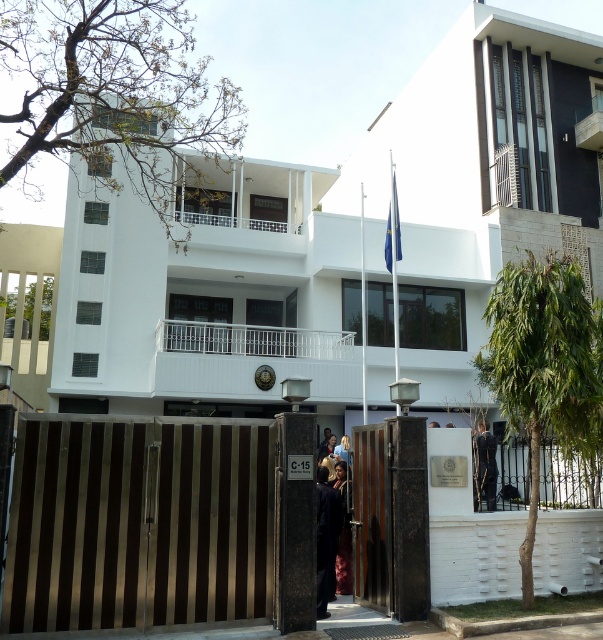
Which is more to the right, dark blue fabric coat at center or dark suit at center?

dark suit at center is more to the right.

Between dark blue fabric coat at center and dark suit at center, which one appears on the left side from the viewer's perspective?

Positioned to the left is dark blue fabric coat at center.

What do you see at coordinates (326, 538) in the screenshot?
I see `dark blue fabric coat at center` at bounding box center [326, 538].

Locate an element on the screen. The width and height of the screenshot is (603, 640). dark blue fabric coat at center is located at coordinates (326, 538).

Looking at this image, is dark suit at center taller than dark brown leather jacket at center?

No, dark suit at center is not taller than dark brown leather jacket at center.

Which is behind, point (476, 483) or point (343, 572)?

Point (476, 483)

The width and height of the screenshot is (603, 640). I want to click on dark suit at center, so click(484, 465).

Between dark brown leather jacket at center and blue fabric flag at center, which one is positioned lower?

dark brown leather jacket at center is lower down.

Who is positioned more to the left, dark brown leather jacket at center or blue fabric flag at center?

dark brown leather jacket at center is more to the left.

Describe the element at coordinates (343, 532) in the screenshot. I see `dark brown leather jacket at center` at that location.

Where is `dark brown leather jacket at center`? The height and width of the screenshot is (640, 603). dark brown leather jacket at center is located at coordinates (343, 532).